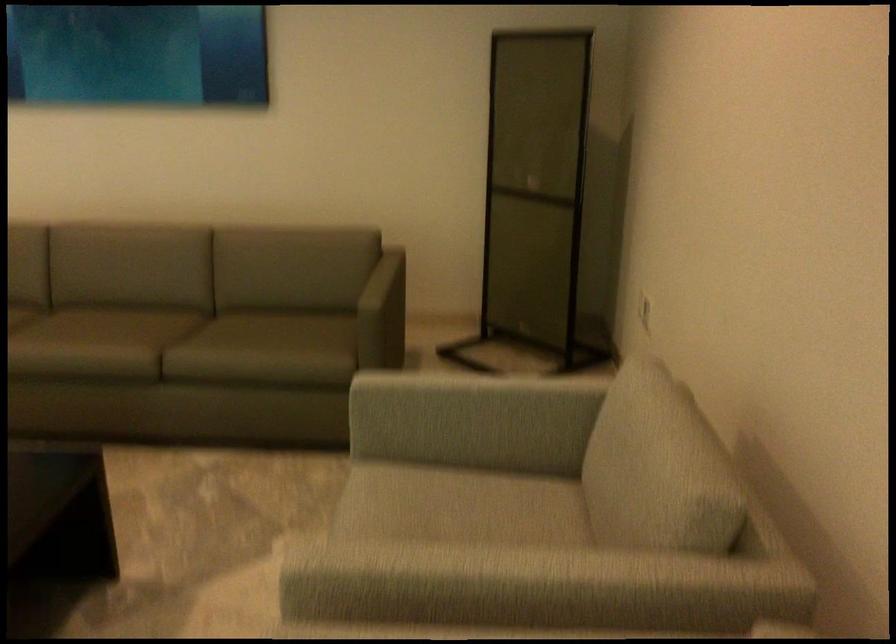
Find where to pull the black room divider. Please return your answer as a coordinate pair (x, y).

(536, 194)